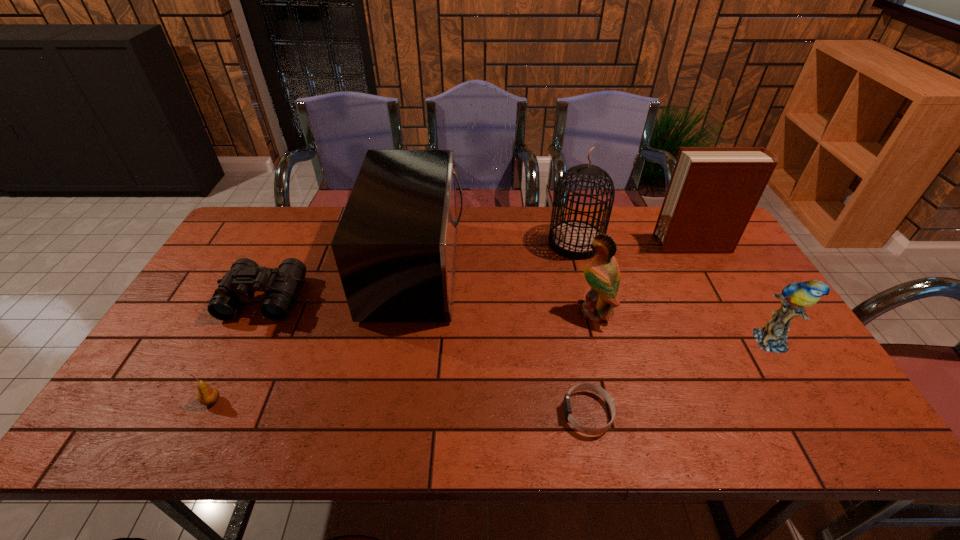
Image resolution: width=960 pixels, height=540 pixels. Identify the location of vacant space situated on the outer surface of the shortest object. (481, 413).

Where is `vacant position located on the outer surface of the shortest object`? The height and width of the screenshot is (540, 960). vacant position located on the outer surface of the shortest object is located at coordinates [x=485, y=413].

In order to click on birdcage located in the far edge section of the desktop in this screenshot , I will do `click(572, 238)`.

Find the location of a particular element. The image size is (960, 540). hardback book that is at the far edge is located at coordinates (713, 191).

I want to click on microwave oven located at the far edge, so click(395, 247).

The height and width of the screenshot is (540, 960). Find the location of `pear located in the near edge section of the desktop`. pear located in the near edge section of the desktop is located at coordinates (207, 395).

At what (x,y) coordinates should I click in order to perform the action: click on wristband that is positioned at the near edge. Please return your answer as a coordinate pair (x, y). The height and width of the screenshot is (540, 960). Looking at the image, I should click on (582, 386).

You are a GUI agent. You are given a task and a screenshot of the screen. Output one action in this format:
    pyautogui.click(x=<x>, y=<y>)
    Task: Click on the object that is at the left edge
    The width and height of the screenshot is (960, 540).
    Given the screenshot: What is the action you would take?
    pyautogui.click(x=281, y=285)

This screenshot has height=540, width=960. Find the location of `hardback book at the right edge`. hardback book at the right edge is located at coordinates (713, 191).

Locate an element on the screen. The height and width of the screenshot is (540, 960). parrot located in the right edge section of the desktop is located at coordinates (772, 337).